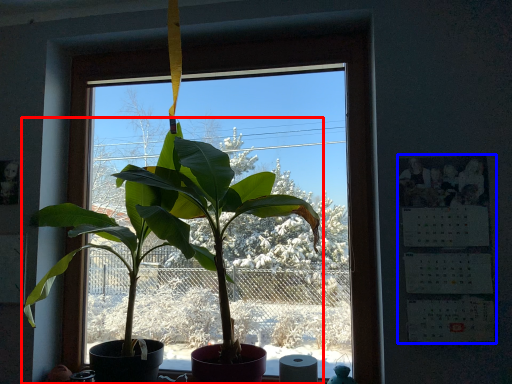
Question: Which point is closer to the camera, houseplant (highlighted by a red box) or bulletin board (highlighted by a blue box)?

Choices:
 (A) houseplant
 (B) bulletin board

Answer: (A)